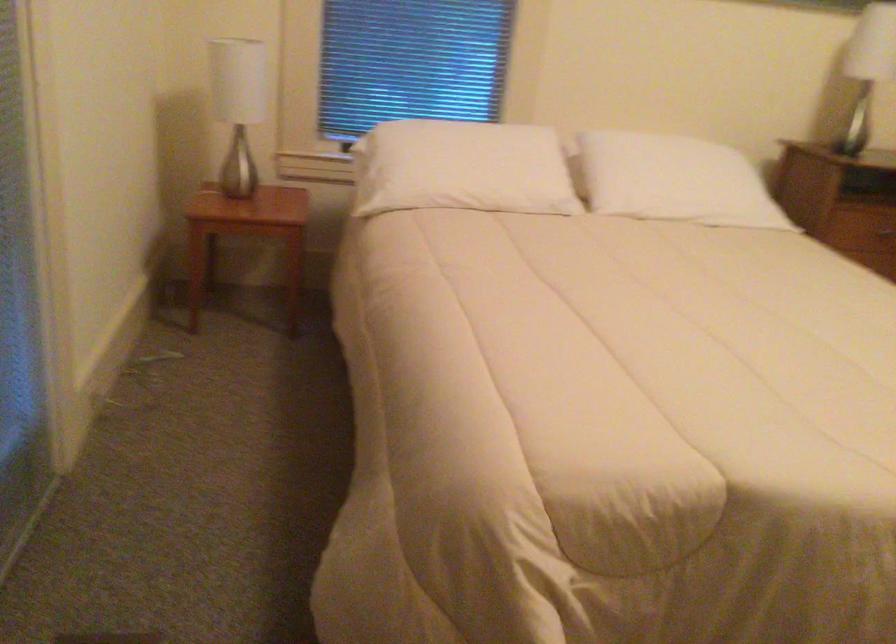
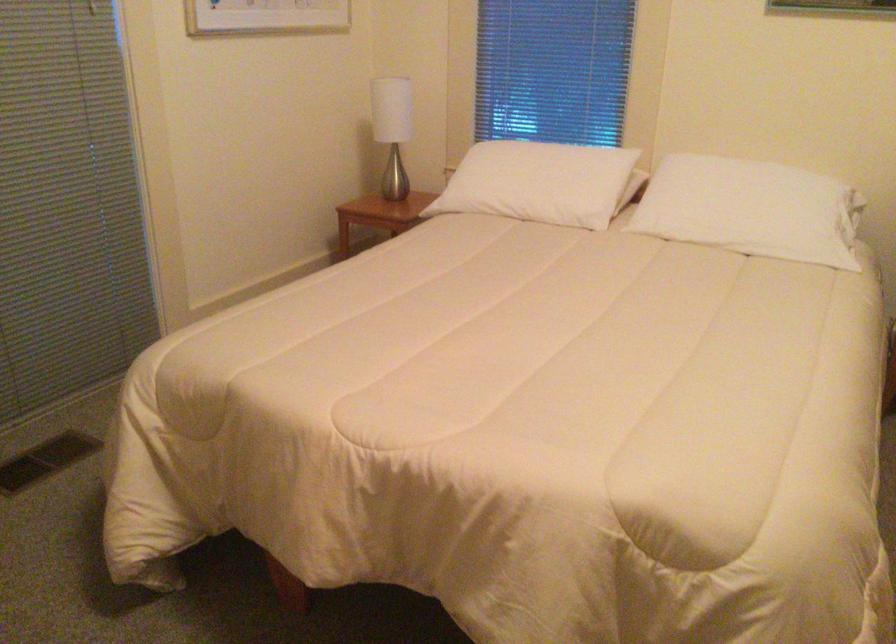
In the second image, find the point that corresponds to point 703,178 in the first image.

(752, 210)